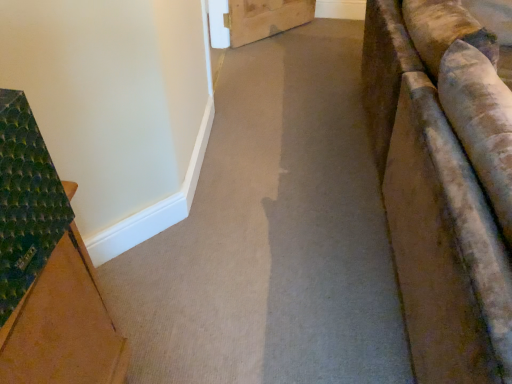
Question: From a real-world perspective, is green textured mat at left positioned above or below carpet at center?

Choices:
 (A) below
 (B) above

Answer: (B)

Question: Does point (41, 221) appear closer or farther from the camera than point (284, 299)?

Choices:
 (A) farther
 (B) closer

Answer: (B)

Question: In terms of size, does green textured mat at left appear bigger or smaller than carpet at center?

Choices:
 (A) small
 (B) big

Answer: (A)

Question: Is carpet at center to the left or to the right of green textured mat at left in the image?

Choices:
 (A) right
 (B) left

Answer: (A)

Question: Is carpet at center spatially inside green textured mat at left, or outside of it?

Choices:
 (A) inside
 (B) outside

Answer: (B)

Question: Looking at the image, does carpet at center seem bigger or smaller compared to green textured mat at left?

Choices:
 (A) small
 (B) big

Answer: (B)

Question: From their relative heights in the image, would you say carpet at center is taller or shorter than green textured mat at left?

Choices:
 (A) tall
 (B) short

Answer: (B)